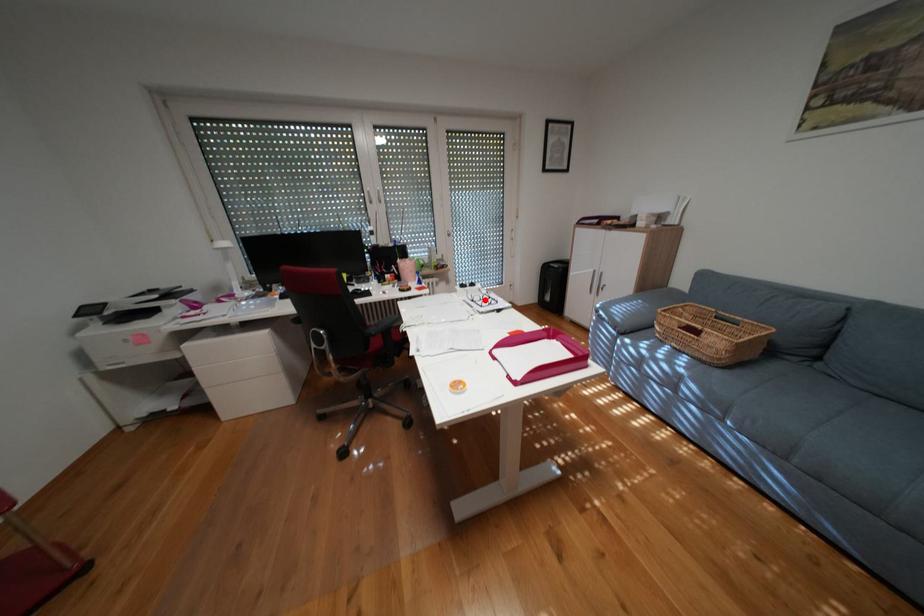
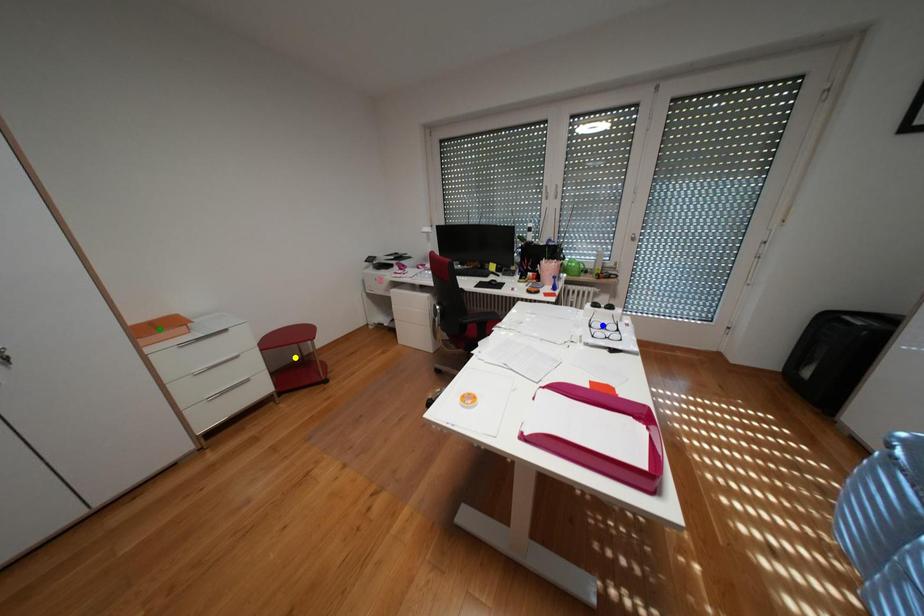
Question: I am providing you with two images of the same scene from different viewpoints. A red point is marked on the first image. You are given multiple points on the second image. Which spot in image 2 lines up with the point in image 1?

Choices:
 (A) green point
 (B) blue point
 (C) yellow point

Answer: (B)